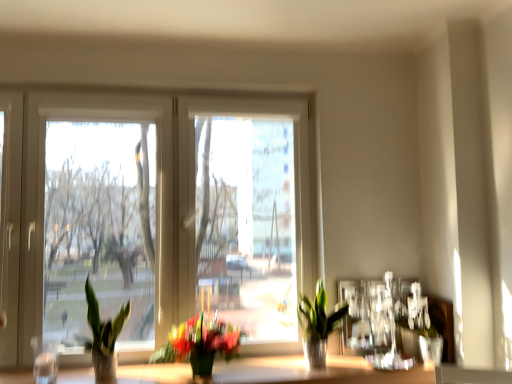
Question: From a real-world perspective, is green glossy plant at center, placed as the 3th houseplant when sorted from left to right, physically below green matte plant at center, positioned as the 2th houseplant in right-to-left order?

Choices:
 (A) no
 (B) yes

Answer: (A)

Question: Is the depth of green glossy plant at center, placed as the 3th houseplant when sorted from left to right, greater than that of green matte plant at center, positioned as the 2th houseplant in right-to-left order?

Choices:
 (A) yes
 (B) no

Answer: (A)

Question: Does green glossy plant at center, placed as the 3th houseplant when sorted from left to right, have a lesser width compared to green matte plant at center, arranged as the 2th houseplant when viewed from the left?

Choices:
 (A) yes
 (B) no

Answer: (A)

Question: Considering the relative sizes of green glossy plant at center, placed as the 3th houseplant when sorted from left to right, and green matte plant at center, arranged as the 2th houseplant when viewed from the left, in the image provided, is green glossy plant at center, placed as the 3th houseplant when sorted from left to right, bigger than green matte plant at center, arranged as the 2th houseplant when viewed from the left,?

Choices:
 (A) no
 (B) yes

Answer: (A)

Question: Can you confirm if green glossy plant at center, the first houseplant in the right-to-left sequence, is positioned to the right of green matte plant at center, positioned as the 2th houseplant in right-to-left order?

Choices:
 (A) no
 (B) yes

Answer: (B)

Question: Is green matte plant at center, arranged as the 2th houseplant when viewed from the left, wider or thinner than green glossy plant at center, the first houseplant in the right-to-left sequence?

Choices:
 (A) wide
 (B) thin

Answer: (A)

Question: Relative to green glossy plant at center, the first houseplant in the right-to-left sequence, is green matte plant at center, positioned as the 2th houseplant in right-to-left order, in front or behind?

Choices:
 (A) behind
 (B) front

Answer: (B)

Question: From the image's perspective, is green matte plant at center, positioned as the 2th houseplant in right-to-left order, above or below green glossy plant at center, placed as the 3th houseplant when sorted from left to right?

Choices:
 (A) above
 (B) below

Answer: (B)

Question: Visually, is green matte plant at center, positioned as the 2th houseplant in right-to-left order, positioned to the left or to the right of green glossy plant at center, placed as the 3th houseplant when sorted from left to right?

Choices:
 (A) right
 (B) left

Answer: (B)

Question: Considering the positions of point (160, 352) and point (284, 317), is point (160, 352) closer or farther from the camera than point (284, 317)?

Choices:
 (A) farther
 (B) closer

Answer: (B)

Question: From a real-world perspective, is green matte plant at center, arranged as the 2th houseplant when viewed from the left, positioned above or below white plastic window at center?

Choices:
 (A) below
 (B) above

Answer: (A)

Question: From the image's perspective, relative to white plastic window at center, is green matte plant at center, arranged as the 2th houseplant when viewed from the left, above or below?

Choices:
 (A) below
 (B) above

Answer: (A)

Question: In terms of width, does green matte plant at center, arranged as the 2th houseplant when viewed from the left, look wider or thinner when compared to white plastic window at center?

Choices:
 (A) thin
 (B) wide

Answer: (B)

Question: Is point (280, 370) positioned closer to the camera than point (26, 327)?

Choices:
 (A) farther
 (B) closer

Answer: (B)

Question: From the image's perspective, is smooth wooden surface at lower center positioned above or below white plastic window at center?

Choices:
 (A) above
 (B) below

Answer: (B)